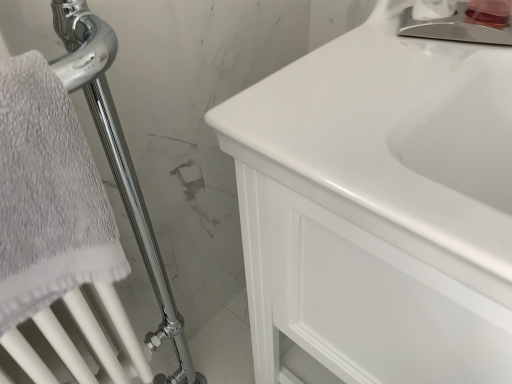
Question: Is white glossy soap dispenser at upper right, which ranks as the second toiletry in right-to-left order, turned away from polished chrome faucet at upper right?

Choices:
 (A) no
 (B) yes

Answer: (A)

Question: Considering the relative sizes of white glossy soap dispenser at upper right, which ranks as the second toiletry in right-to-left order, and polished chrome faucet at upper right in the image provided, is white glossy soap dispenser at upper right, which ranks as the second toiletry in right-to-left order, thinner than polished chrome faucet at upper right?

Choices:
 (A) no
 (B) yes

Answer: (B)

Question: Considering the relative positions of white glossy soap dispenser at upper right, which ranks as the first toiletry in left-to-right order, and polished chrome faucet at upper right in the image provided, is white glossy soap dispenser at upper right, which ranks as the first toiletry in left-to-right order, to the right of polished chrome faucet at upper right from the viewer's perspective?

Choices:
 (A) yes
 (B) no

Answer: (B)

Question: Is white glossy soap dispenser at upper right, which ranks as the second toiletry in right-to-left order, not within polished chrome faucet at upper right?

Choices:
 (A) no
 (B) yes

Answer: (B)

Question: Can you confirm if white glossy soap dispenser at upper right, which ranks as the first toiletry in left-to-right order, is shorter than polished chrome faucet at upper right?

Choices:
 (A) yes
 (B) no

Answer: (B)

Question: Is white glossy soap dispenser at upper right, which ranks as the first toiletry in left-to-right order, next to polished chrome faucet at upper right?

Choices:
 (A) no
 (B) yes

Answer: (B)

Question: From the image's perspective, is pink plastic container at upper right, which is counted as the 1th toiletry, starting from the right, under white glossy cabinet at center?

Choices:
 (A) yes
 (B) no

Answer: (B)

Question: Is pink plastic container at upper right, which is counted as the 1th toiletry, starting from the right, not near white glossy cabinet at center?

Choices:
 (A) yes
 (B) no

Answer: (B)

Question: Is pink plastic container at upper right, which is counted as the 1th toiletry, starting from the right, positioned behind white glossy cabinet at center?

Choices:
 (A) yes
 (B) no

Answer: (A)

Question: Can you confirm if pink plastic container at upper right, which is counted as the 1th toiletry, starting from the right, is positioned to the left of white glossy cabinet at center?

Choices:
 (A) no
 (B) yes

Answer: (A)

Question: From a real-world perspective, is pink plastic container at upper right, the second toiletry when ordered from left to right, under white glossy cabinet at center?

Choices:
 (A) no
 (B) yes

Answer: (A)

Question: Is pink plastic container at upper right, the second toiletry when ordered from left to right, bigger than white glossy cabinet at center?

Choices:
 (A) yes
 (B) no

Answer: (B)

Question: Does white glossy soap dispenser at upper right, which ranks as the second toiletry in right-to-left order, turn towards pink plastic container at upper right, which is counted as the 1th toiletry, starting from the right?

Choices:
 (A) yes
 (B) no

Answer: (B)